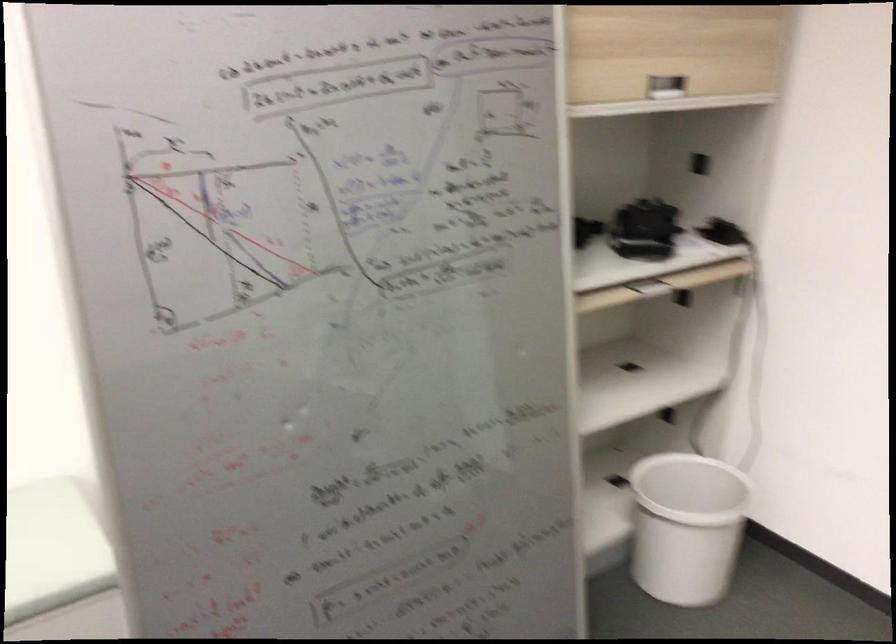
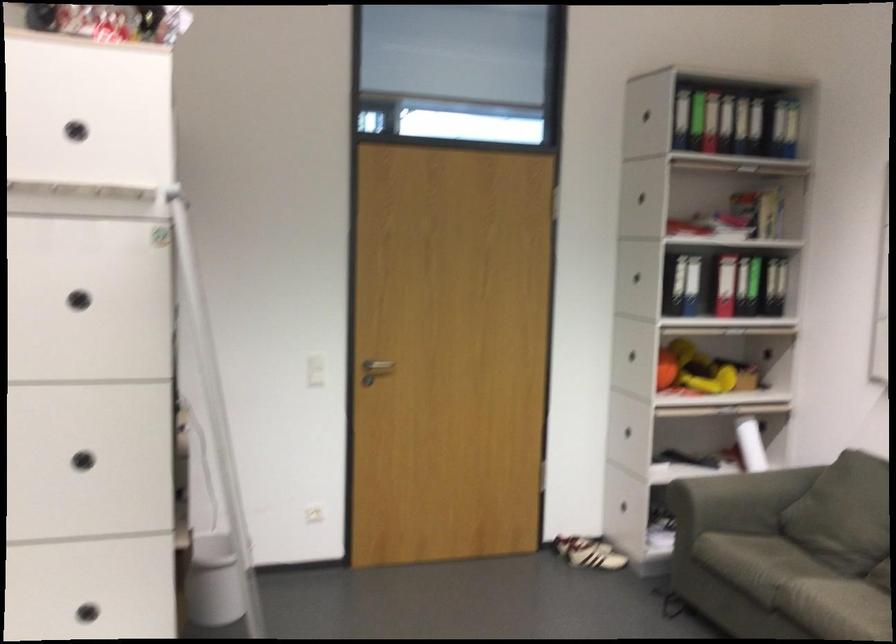
Question: I am providing you with two images of the same scene from different viewpoints. Please identify which objects are invisible in image2.

Choices:
 (A) white trash can
 (B) small gray trashcan
 (C) rolled white paper
 (D) small ironing board

Answer: (A)